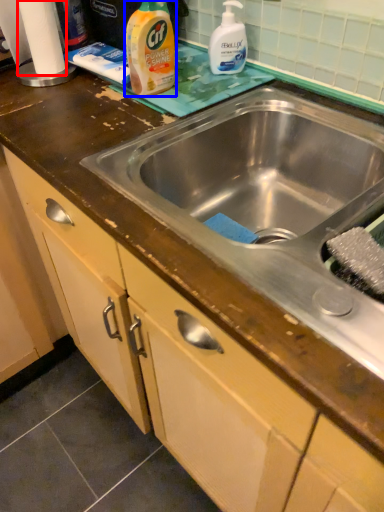
Question: Which of the following is the closest to the observer, toilet paper (highlighted by a red box) or cleaning product (highlighted by a blue box)?

Choices:
 (A) toilet paper
 (B) cleaning product

Answer: (B)